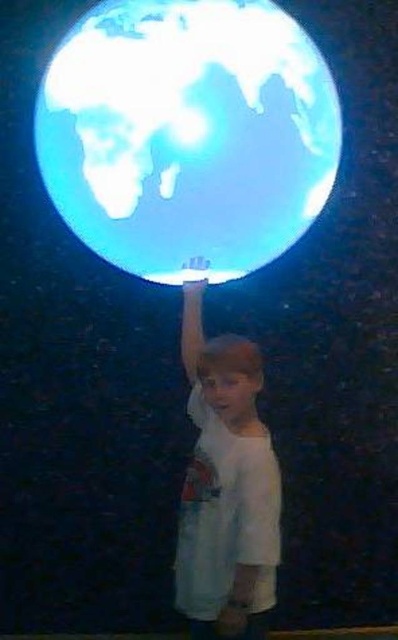
In the scene shown: Which of these two, transparent glass globe at upper center or white cotton shirt at center, stands taller?

white cotton shirt at center is taller.

Can you confirm if transparent glass globe at upper center is smaller than white cotton shirt at center?

Yes, transparent glass globe at upper center is smaller than white cotton shirt at center.

The width and height of the screenshot is (398, 640). What are the coordinates of `transparent glass globe at upper center` in the screenshot? It's located at (187, 134).